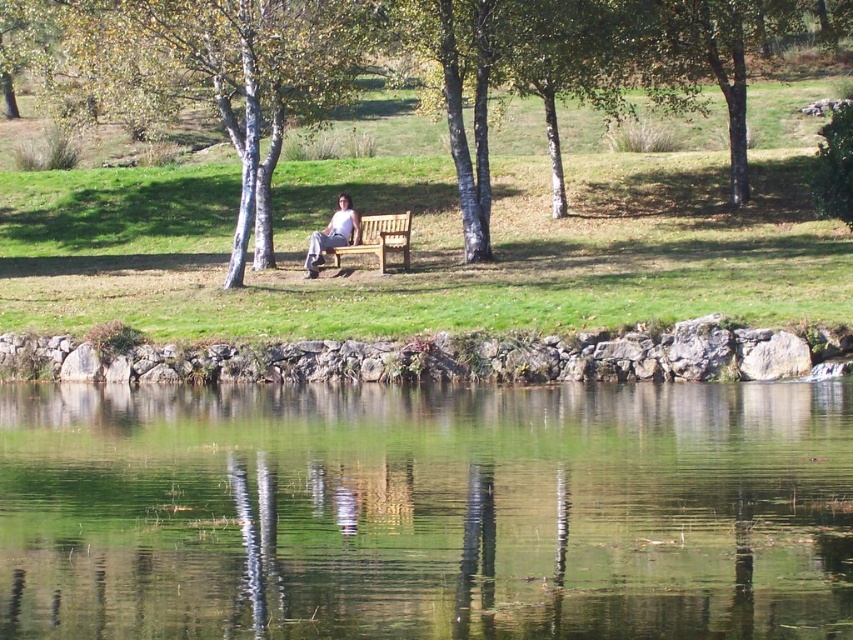
Is point (225, 488) less distant than point (383, 232)?

Yes, point (225, 488) is closer to viewer.

Measure the distance between green reflective water at center and light brown wooden bench at center.

The distance of green reflective water at center from light brown wooden bench at center is 9.24 meters.

Does point (851, 433) come farther from viewer compared to point (361, 228)?

That is False.

You are a GUI agent. You are given a task and a screenshot of the screen. Output one action in this format:
    pyautogui.click(x=<x>, y=<y>)
    Task: Click on the green reflective water at center
    This screenshot has height=640, width=853.
    Given the screenshot: What is the action you would take?
    pyautogui.click(x=426, y=512)

Is brown bark tree at center shorter than light brown wooden bench at center?

Incorrect, brown bark tree at center's height does not fall short of light brown wooden bench at center's.

Who is more distant from viewer, [134,60] or [399,236]?

The point [134,60] is more distant.

Identify the location of brown bark tree at center. The height and width of the screenshot is (640, 853). (225, 72).

Which is more to the left, green reflective water at center or light blue denim jeans at center?

light blue denim jeans at center

Between point (543, 500) and point (315, 250), which one is positioned behind?

Point (315, 250)

Where is `green reflective water at center`? The width and height of the screenshot is (853, 640). green reflective water at center is located at coordinates (426, 512).

Find the location of `green reflective water at center`. green reflective water at center is located at coordinates (426, 512).